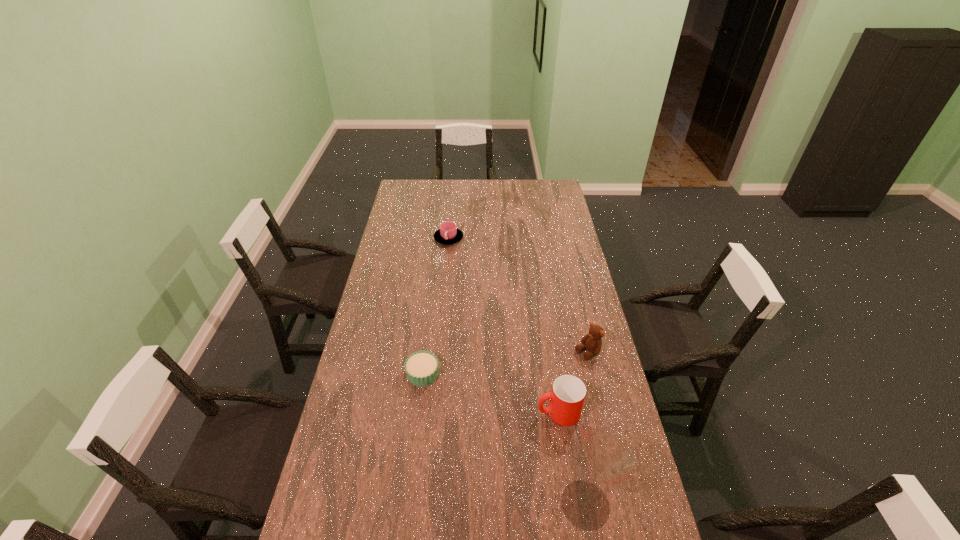
Image resolution: width=960 pixels, height=540 pixels. I want to click on vacant space in between the cupcake and the right cup, so click(x=491, y=394).

Locate an element on the screen. free point between the flute glass and the teddy bear is located at coordinates (587, 429).

This screenshot has height=540, width=960. In order to click on unoccupied area between the cupcake and the nearest object in this screenshot , I will do `click(504, 440)`.

Where is `vacant space that's between the shorter cup and the right cup`? This screenshot has height=540, width=960. vacant space that's between the shorter cup and the right cup is located at coordinates (503, 325).

Identify the location of free space between the teddy bear and the cupcake. (x=505, y=363).

Locate an element on the screen. Image resolution: width=960 pixels, height=540 pixels. free point between the teddy bear and the left cup is located at coordinates (518, 295).

Locate an element on the screen. The width and height of the screenshot is (960, 540). vacant space in between the flute glass and the farthest object is located at coordinates (516, 372).

Find the location of a particular element. The width and height of the screenshot is (960, 540). object that can be found as the fourth closest to the right cup is located at coordinates (448, 233).

Select which object appears as the fourth closest to the teddy bear. Please provide its 2D coordinates. Your answer should be formatted as a tuple, i.e. [(x, y)], where the tuple contains the x and y coordinates of a point satisfying the conditions above.

[(448, 233)]

Locate an element on the screen. Image resolution: width=960 pixels, height=540 pixels. vacant point that satisfies the following two spatial constraints: 1. on the back side of the farthest object; 2. on the left side of the cupcake is located at coordinates (439, 238).